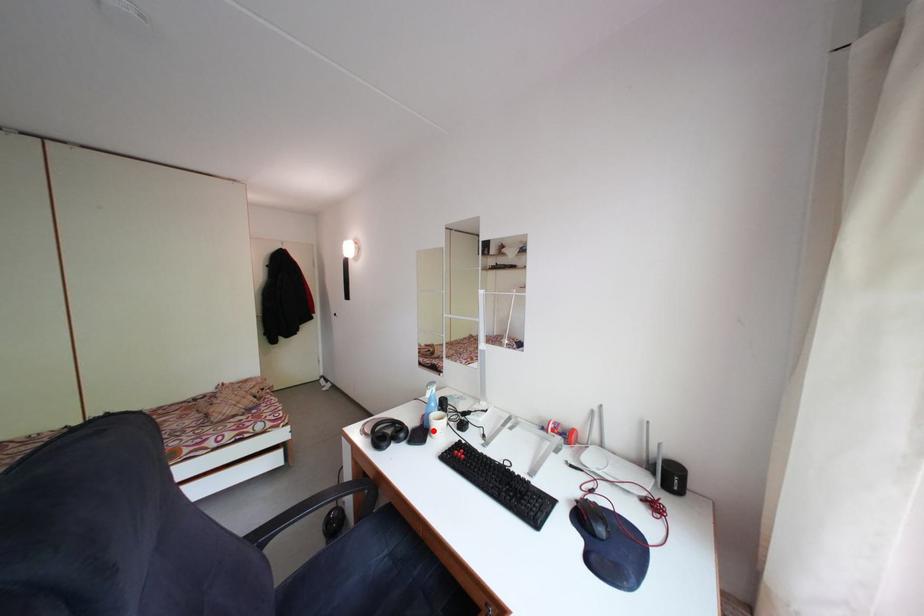
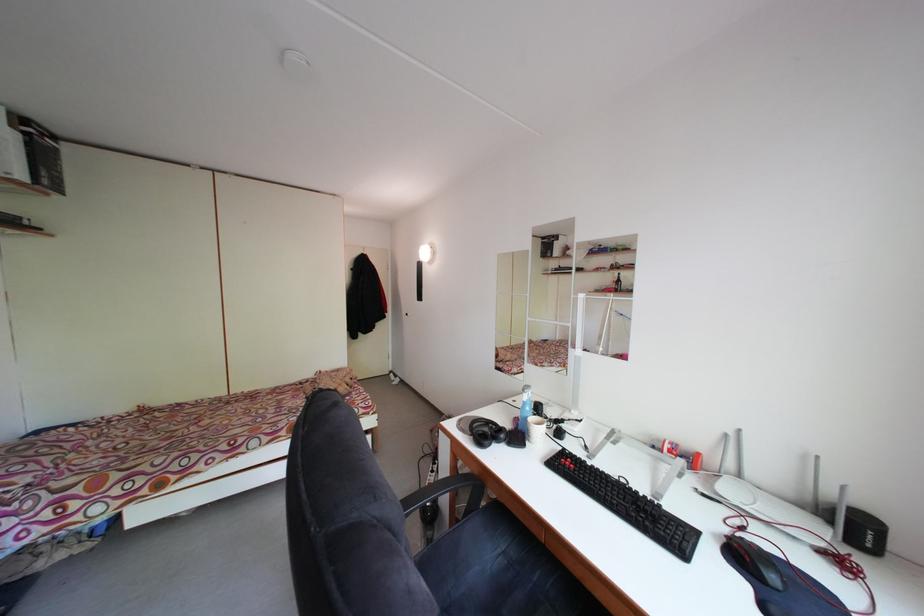
Question: I am providing you with two images of the same scene from different viewpoints. Image1 has a red point marked. In image2, the corresponding 3D location appears at what relative position? Reply with the corresponding letter.

Choices:
 (A) Closer
 (B) Farther

Answer: (A)